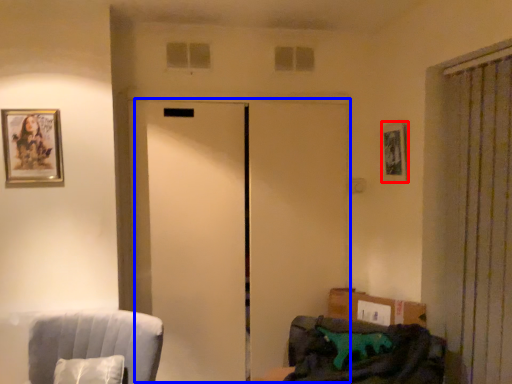
Question: Which of the following is the closest to the observer, picture frame (highlighted by a red box) or elevator (highlighted by a blue box)?

Choices:
 (A) picture frame
 (B) elevator

Answer: (B)